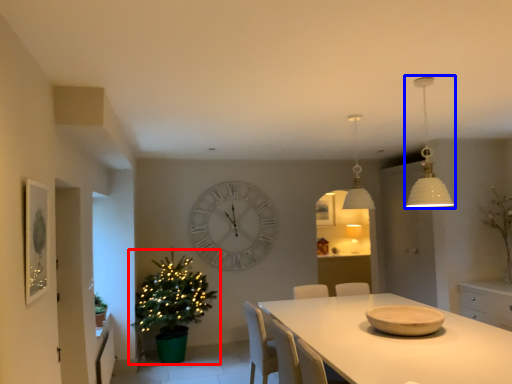
Question: Which object is further to the camera taking this photo, christmas tree (highlighted by a red box) or lamp (highlighted by a blue box)?

Choices:
 (A) christmas tree
 (B) lamp

Answer: (A)